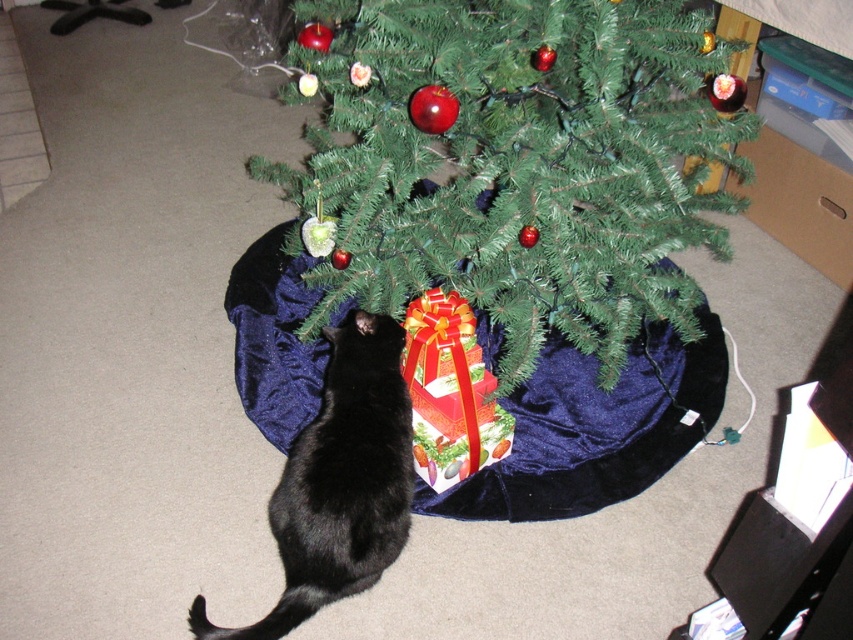
Question: Can you confirm if green matte christmas tree at center is smaller than black fur cat at lower center?

Choices:
 (A) no
 (B) yes

Answer: (A)

Question: Which point is closer to the camera?

Choices:
 (A) green matte christmas tree at center
 (B) shiny paper gift at under tree
 (C) black fur cat at lower center

Answer: (A)

Question: Which object is closer to the camera taking this photo?

Choices:
 (A) shiny paper gift at under tree
 (B) green matte christmas tree at center

Answer: (B)

Question: Does black fur cat at lower center appear under shiny paper gift at under tree?

Choices:
 (A) yes
 (B) no

Answer: (A)

Question: Does black fur cat at lower center lie behind shiny paper gift at under tree?

Choices:
 (A) no
 (B) yes

Answer: (A)

Question: Which of the following is the farthest from the observer?

Choices:
 (A) (281, 618)
 (B) (695, 80)
 (C) (440, 356)

Answer: (C)